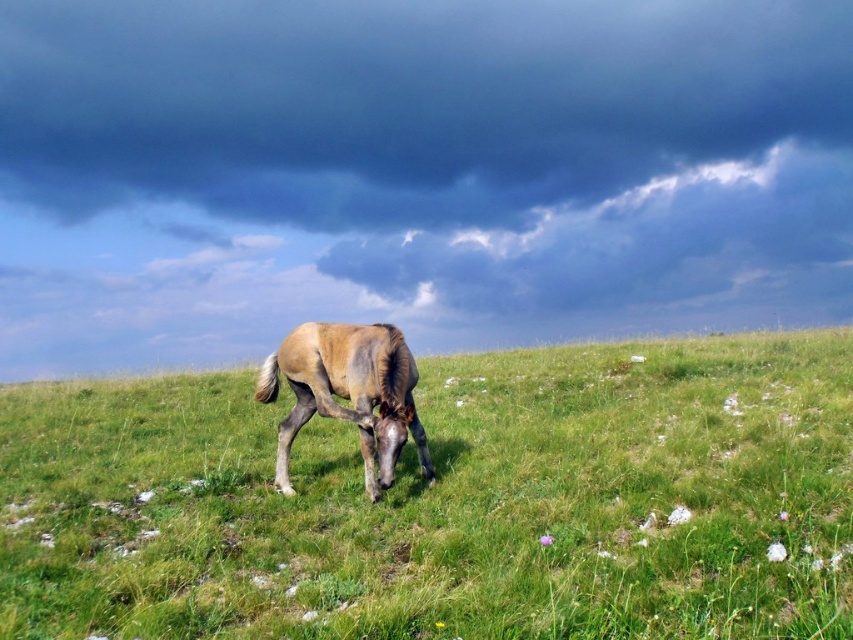
Question: Can you confirm if green grassy at center is bigger than brown textured horse at center?

Choices:
 (A) no
 (B) yes

Answer: (B)

Question: Which point is closer to the camera?

Choices:
 (A) brown textured horse at center
 (B) green grassy at center

Answer: (B)

Question: Which object is closer to the camera taking this photo?

Choices:
 (A) brown textured horse at center
 (B) green grassy at center

Answer: (B)

Question: Which point is farther from the camera taking this photo?

Choices:
 (A) pos(403,502)
 (B) pos(300,346)

Answer: (B)

Question: Does green grassy at center appear under brown textured horse at center?

Choices:
 (A) yes
 (B) no

Answer: (A)

Question: Does green grassy at center appear on the left side of brown textured horse at center?

Choices:
 (A) no
 (B) yes

Answer: (A)